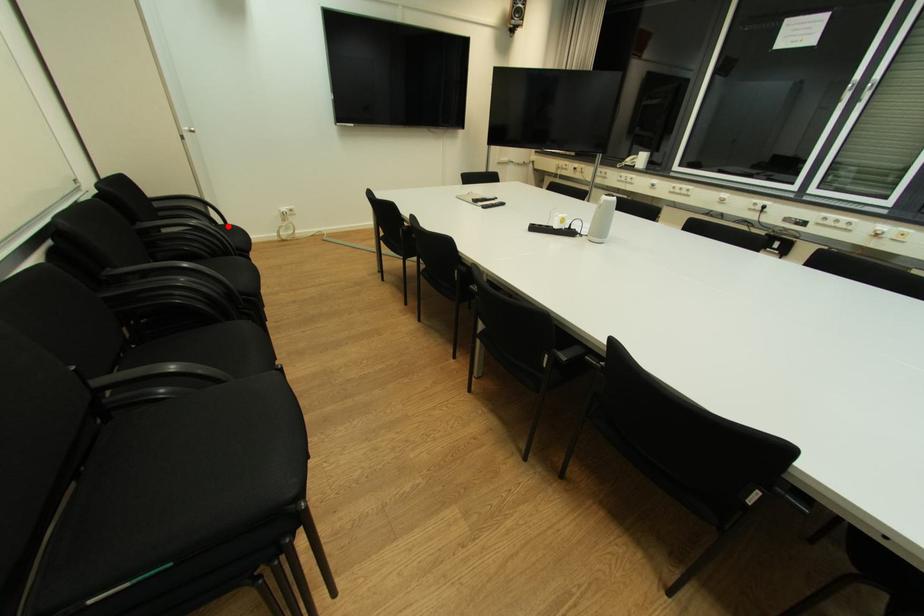
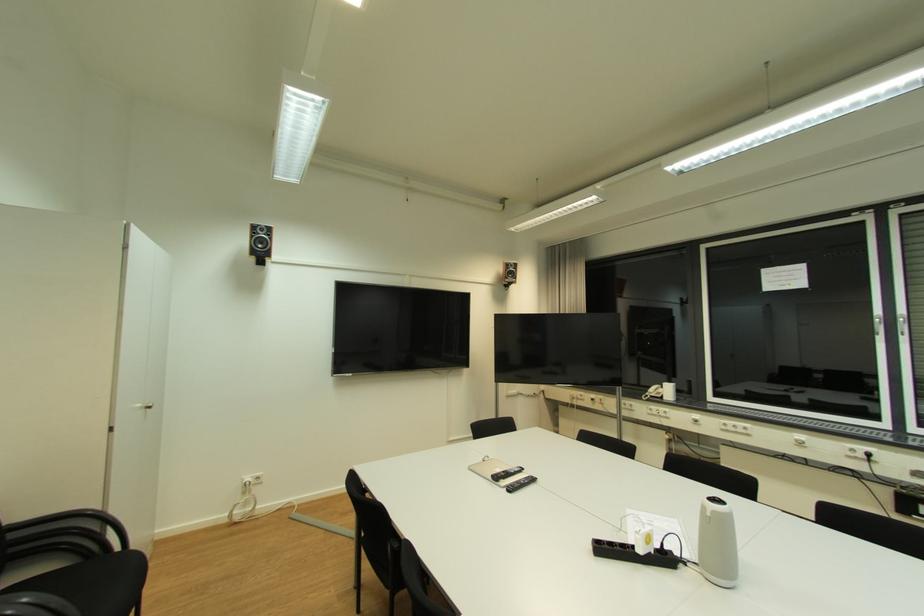
Question: I am providing you with two images of the same scene from different viewpoints. Given a red point in image1, look at the same physical point in image2. Is it:

Choices:
 (A) Closer to the viewpoint
 (B) Farther from the viewpoint

Answer: (B)